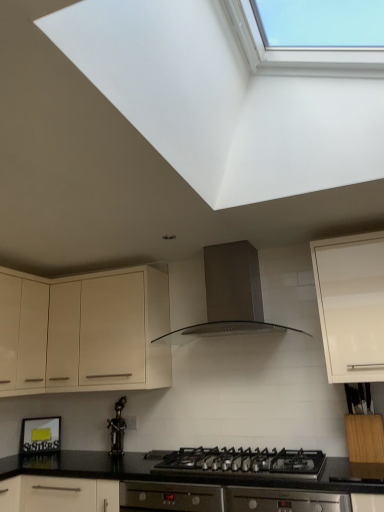
Question: From the image's perspective, is white glossy cabinet at upper right, which is counted as the 1th cabinetry, starting from the right, above or below satin silver range hood at center?

Choices:
 (A) below
 (B) above

Answer: (A)

Question: Visually, is white glossy cabinet at upper right, which is counted as the 1th cabinetry, starting from the right, positioned to the left or to the right of satin silver range hood at center?

Choices:
 (A) left
 (B) right

Answer: (B)

Question: Estimate the real-world distances between objects in this image. Which object is closer to the bronze statue at center?

Choices:
 (A) matte cream cabinet at upper left, the 2th cabinetry viewed from the front
 (B) white glossy cabinet at upper right, which appears as the second cabinetry when viewed from the left
 (C) black matte gas stove at center
 (D) satin silver range hood at center

Answer: (A)

Question: Which object is positioned farthest from the white glossy cabinet at upper right, which appears as the second cabinetry when viewed from the left?

Choices:
 (A) matte cream cabinet at upper left, marked as the 1th cabinetry in a left-to-right arrangement
 (B) black matte gas stove at center
 (C) satin silver range hood at center
 (D) bronze statue at center

Answer: (D)